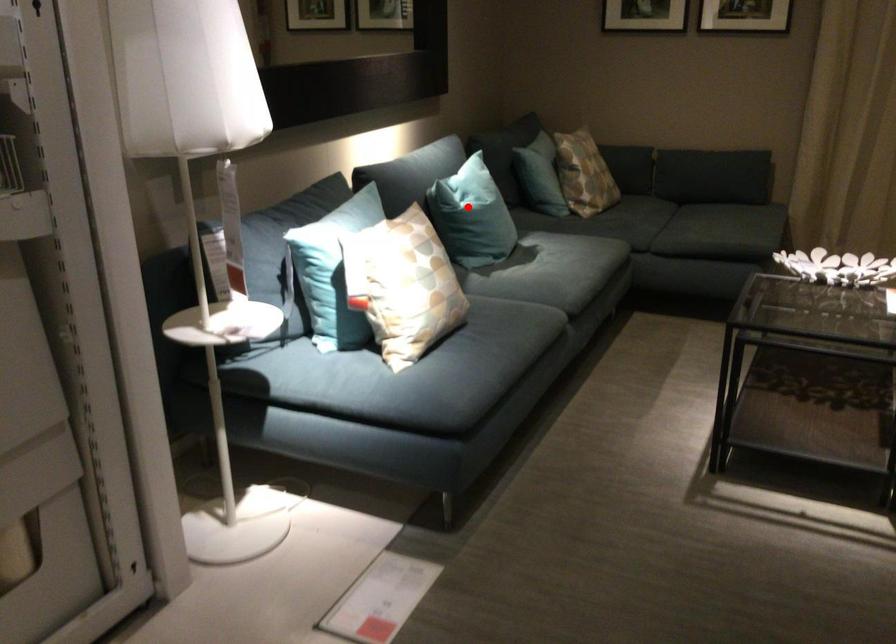
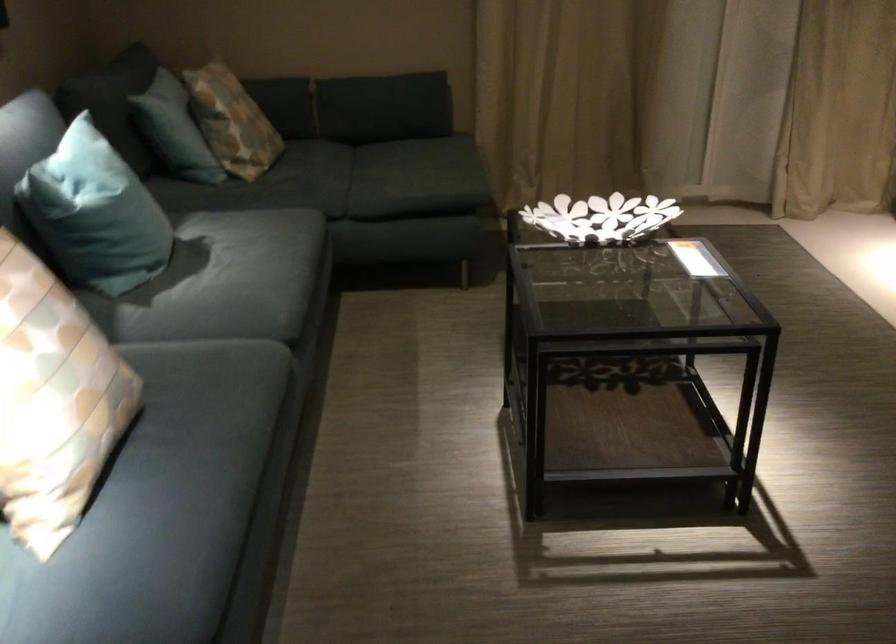
Locate, in the second image, the point that corresponds to the highlighted location in the first image.

(95, 214)